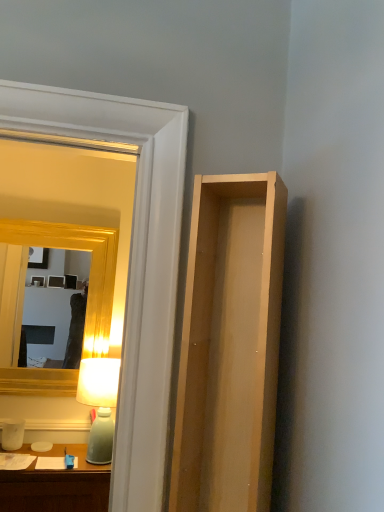
The height and width of the screenshot is (512, 384). Identify the location of free point above matte green glass table lamp at left (from a real-world perspective). (100, 358).